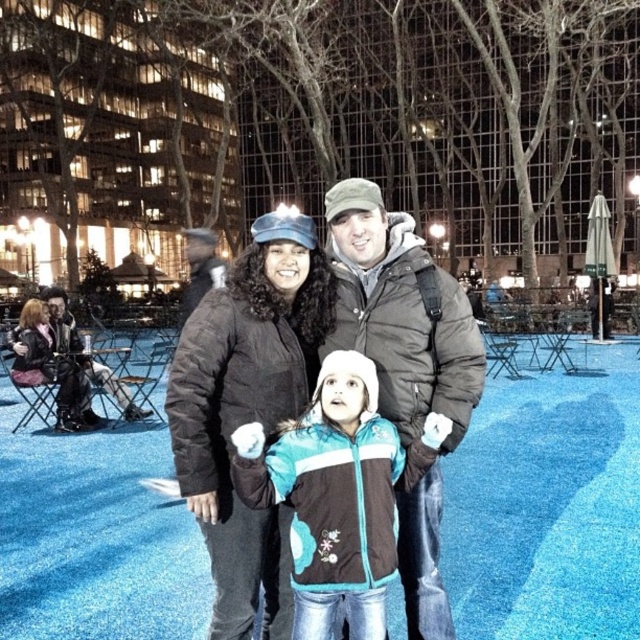
In the scene shown: You are a photographer trying to capture a photo of the black puffy coat at center and the teal and white jacket at center. Based on their positions, which one should you focus on first to ensure both are in frame?

The black puffy coat at center is located above the teal and white jacket at center, so you should focus on the black puffy coat at center first to ensure both are in frame.

You are a photographer trying to capture a clear shot of both the teal and white jacket at center and the leather jacket at left. Since you want to ensure both are in focus, which one should you focus on first considering their positions?

The teal and white jacket at center is in front of the leather jacket at left, so you should focus on the teal and white jacket at center first to ensure both are in focus.

You are a photographer trying to capture a group photo of the dark brown puffy coat at center and the leather jacket at left. If you want to ensure both subjects are fully visible in the frame, which subject should you position closer to the camera?

The dark brown puffy coat at center has a lesser width compared to the leather jacket at left, so you should position the dark brown puffy coat at center closer to the camera to ensure both are fully visible.